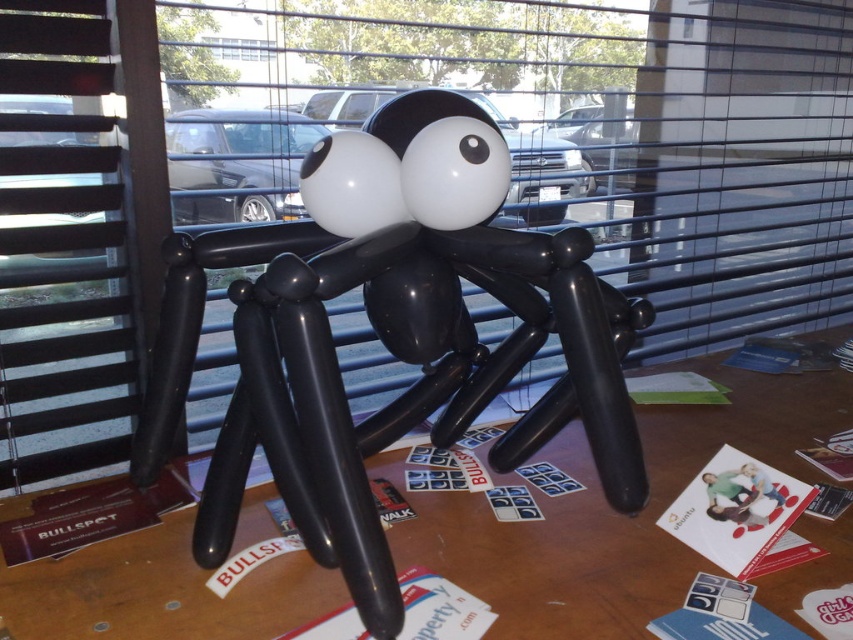
You are setting up a party decoration and need to place two spider balloon sculptures on a table. The table is 14 inches wide. Can both the black rubber balloon spider at center and the black matte balloon spider at center fit side by side on the table without overlapping?

The black rubber balloon spider at center and the black matte balloon spider at center are 12.73 inches apart. Since the table is 14 inches wide, there is enough space to place both spiders side by side without overlapping as 12.73 inches is less than 14 inches.

Looking at this image, you are organizing a party and need to choose between the black rubber balloon spider at center and the black matte balloon spider at center for a centerpiece. Which one will take up more space on the table?

The black matte balloon spider at center has a greater width than the black rubber balloon spider at center, so it will take up more space on the table.

You are standing in front of the spider balloon sculpture on the table. You notice two points marked on the table surface. One is at coordinates point (x=447, y=320) and the other at point (x=773, y=456). Which point is closer to you?

Point (x=447, y=320) is closer to the viewer than point (x=773, y=456).